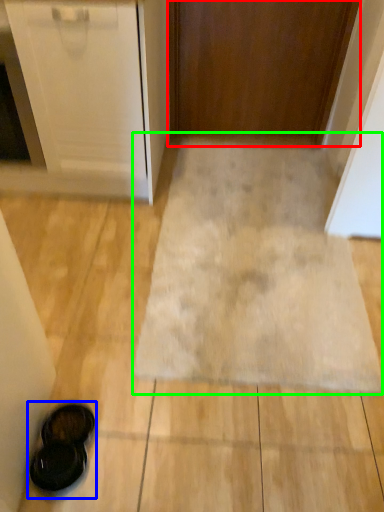
Question: Considering the real-world distances, which object is closest to door (highlighted by a red box)? footwear (highlighted by a blue box) or bath mat (highlighted by a green box).

Choices:
 (A) footwear
 (B) bath mat

Answer: (B)